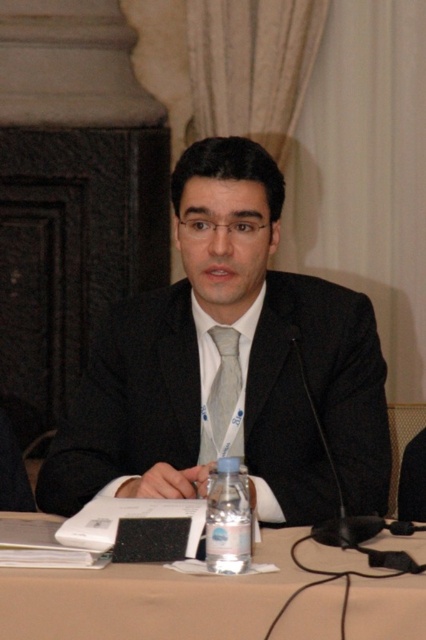
Question: Which point is farther to the camera?

Choices:
 (A) (233, 333)
 (B) (290, 618)

Answer: (A)

Question: Is black matte suit at center below clear plastic bottle at center?

Choices:
 (A) no
 (B) yes

Answer: (A)

Question: Which point is closer to the camera?

Choices:
 (A) (213, 518)
 (B) (270, 381)

Answer: (A)

Question: Estimate the real-world distances between objects in this image. Which object is farther from the black matte suit at center?

Choices:
 (A) silky silver tie at center
 (B) white plastic table at center

Answer: (B)

Question: Can you confirm if black matte suit at center is bigger than white plastic table at center?

Choices:
 (A) no
 (B) yes

Answer: (B)

Question: Is black matte suit at center bigger than clear plastic bottle at center?

Choices:
 (A) yes
 (B) no

Answer: (A)